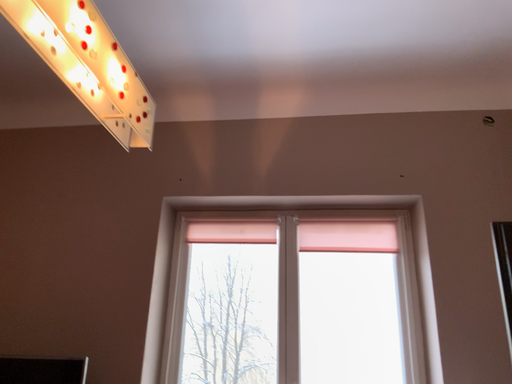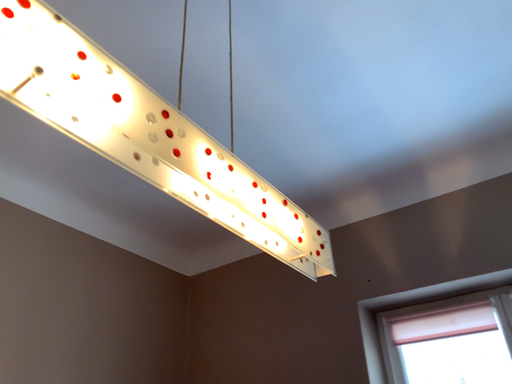
Question: Which way did the camera rotate in the video?

Choices:
 (A) rotated upward
 (B) rotated downward

Answer: (A)